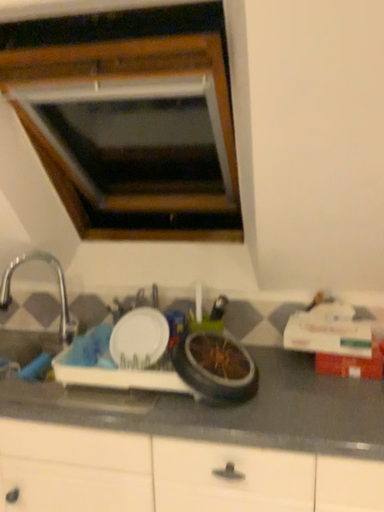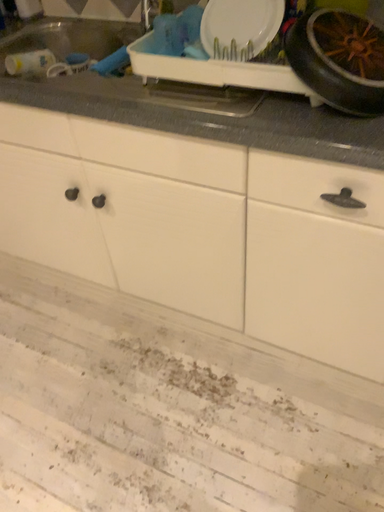
Question: How did the camera likely rotate when shooting the video?

Choices:
 (A) rotated right
 (B) rotated left

Answer: (B)